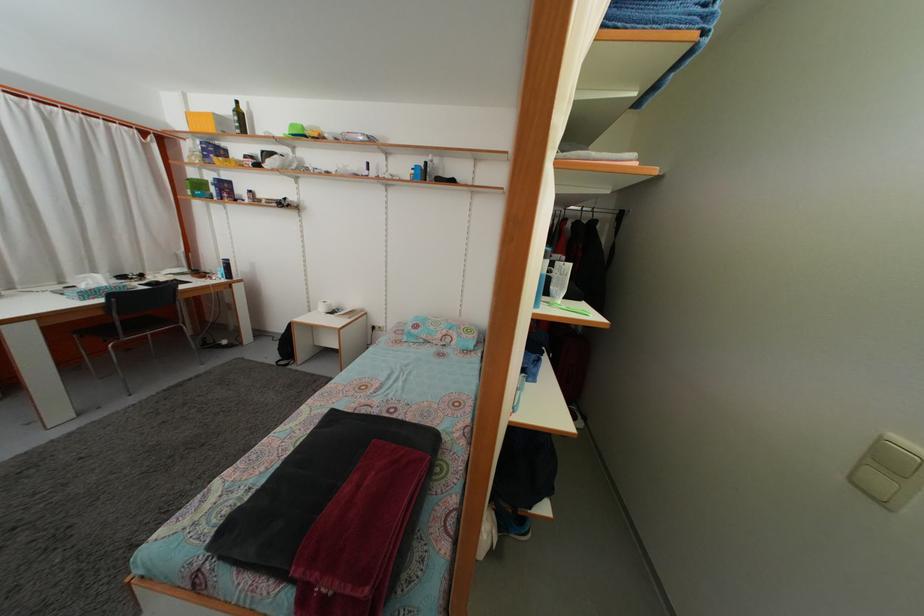
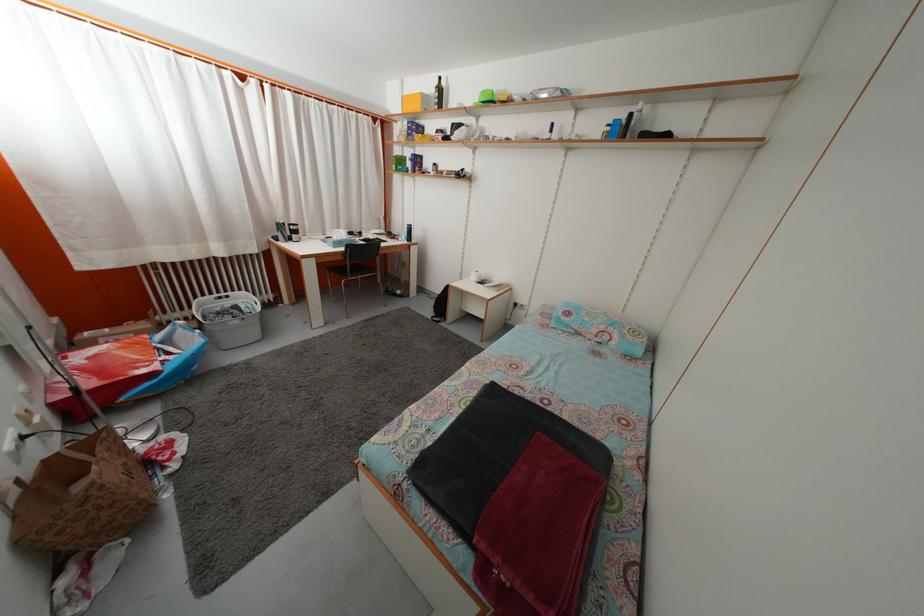
Question: The images are taken continuously from a first-person perspective. In which direction is your viewpoint rotating?

Choices:
 (A) Left
 (B) Right
 (C) Up
 (D) Down

Answer: (A)